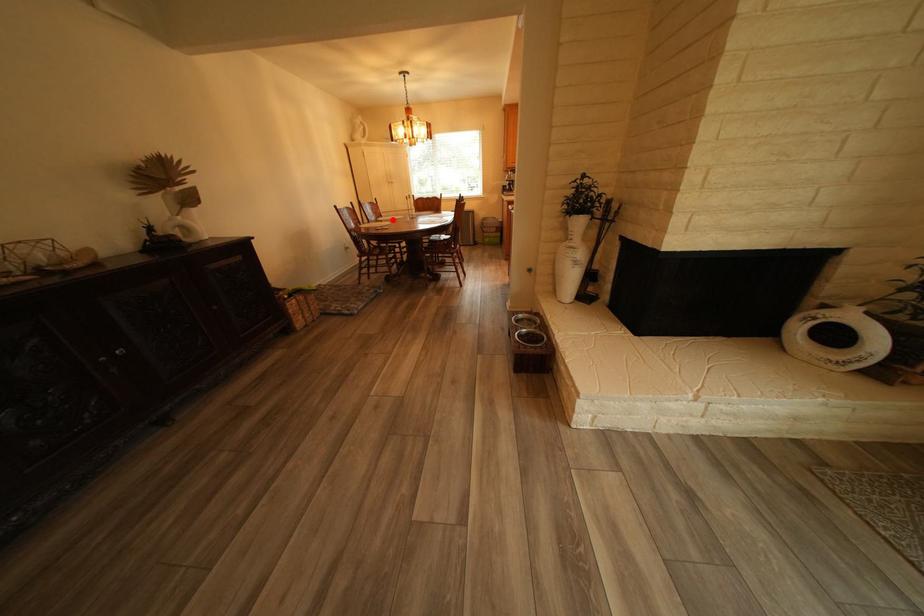
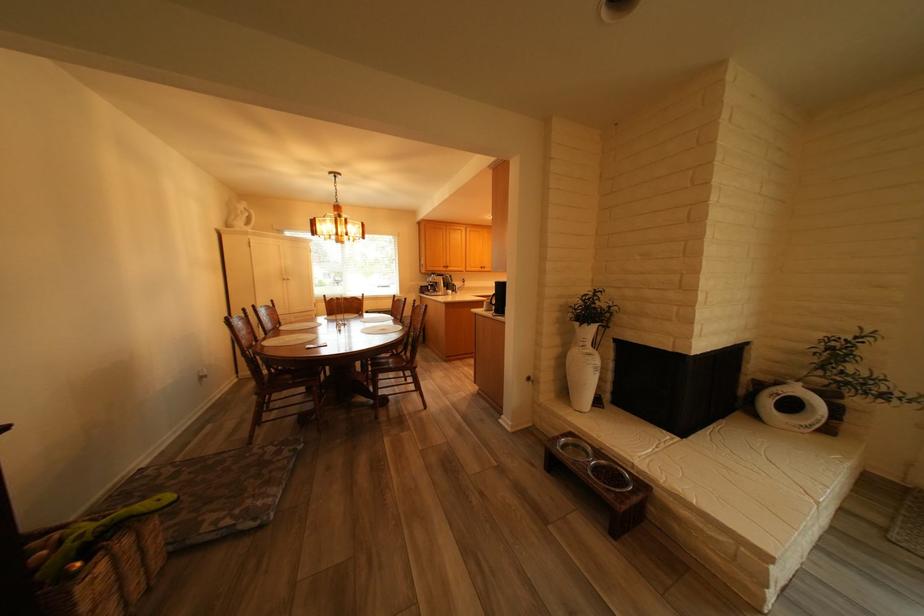
Question: I am providing you with two images of the same scene from different viewpoints. A red point is marked on the first image. At the location where the point appears in image 1, is it still visible in image 2?

Choices:
 (A) Yes
 (B) No

Answer: (A)